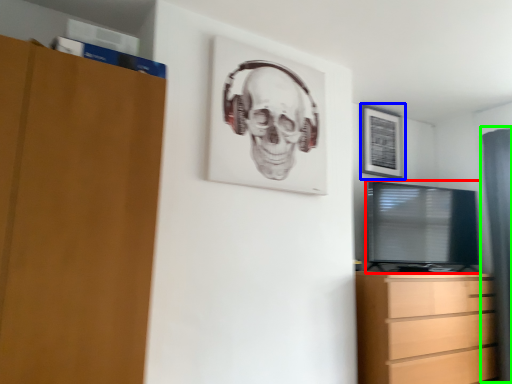
Question: Based on their relative distances, which object is farther from television (highlighted by a red box)? Choose from picture frame (highlighted by a blue box) and curtain (highlighted by a green box).

Choices:
 (A) picture frame
 (B) curtain

Answer: (B)